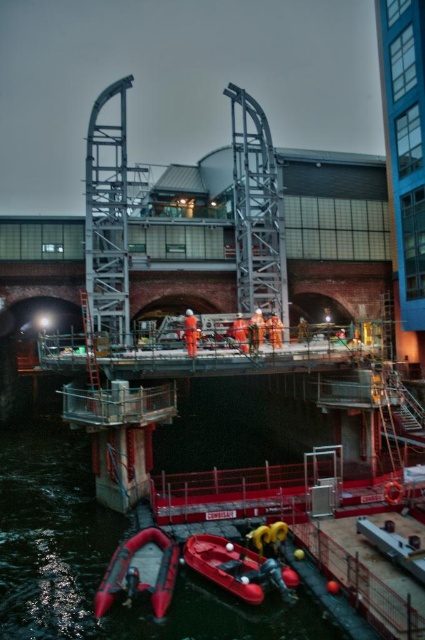
Can you confirm if rubber boat at lower center is smaller than orange reflective safety suit at center?

No.

In the scene shown: Between rubber boat at lower center and orange reflective safety suit at center, which one appears on the right side from the viewer's perspective?

orange reflective safety suit at center

Between point (34, 470) and point (193, 346), which one is positioned behind?

The point (34, 470) is more distant.

Identify the location of rubber boat at lower center. The height and width of the screenshot is (640, 425). (102, 561).

Is rubberized red inflatable boat at lower center to the left of orange reflective safety suit at center from the viewer's perspective?

No, rubberized red inflatable boat at lower center is not to the left of orange reflective safety suit at center.

Can you confirm if rubberized red inflatable boat at lower center is taller than orange reflective safety suit at center?

No, rubberized red inflatable boat at lower center is not taller than orange reflective safety suit at center.

I want to click on rubberized red inflatable boat at lower center, so click(238, 568).

Is point (193, 595) in front of point (110, 604)?

No, (193, 595) is behind (110, 604).

The width and height of the screenshot is (425, 640). I want to click on rubber boat at lower center, so click(102, 561).

Where is `rubber boat at lower center`? This screenshot has width=425, height=640. rubber boat at lower center is located at coordinates (102, 561).